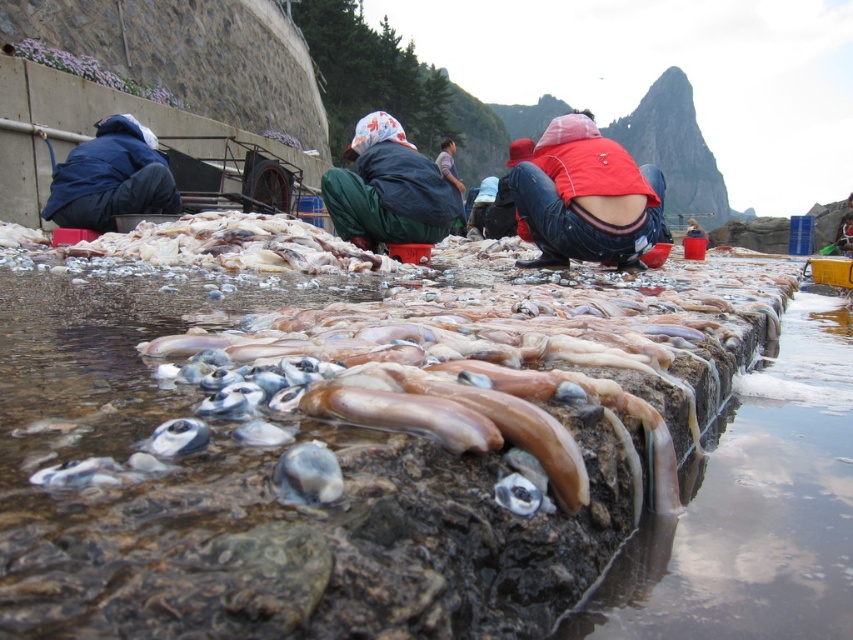
You are a customer at the fish market and want to pick up the translucent wet rock at center and the red matte jacket at center. Which one is closer to your left hand if you are facing the scene?

The translucent wet rock at center is to the left of red matte jacket at center, so if you are facing the scene, the translucent wet rock at center is closer to your left hand.

Looking at this image, you are standing at the edge of the fish market scene and want to reach the red matte jacket at center without stepping on the translucent wet rock at center. Is this possible based on their positions?

The translucent wet rock at center is in front of the red matte jacket at center, so you would have to step over or around the translucent wet rock at center to reach the red matte jacket at center without stepping on it.